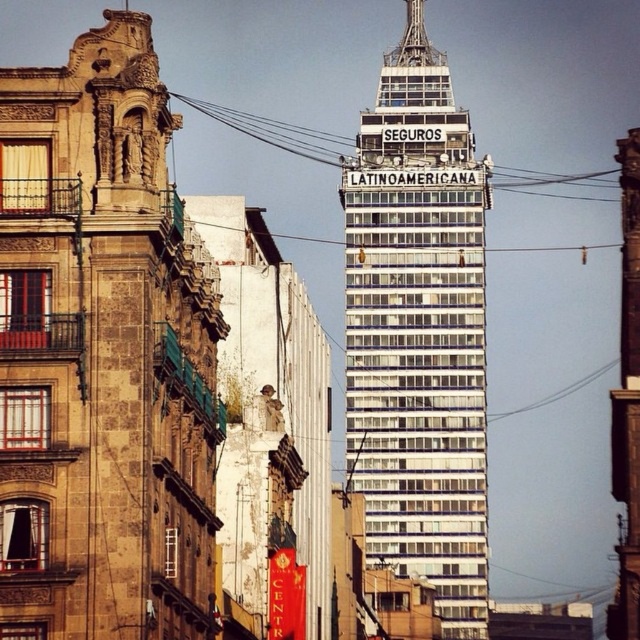
Question: Is brown stone building at left above white glass building at center?

Choices:
 (A) no
 (B) yes

Answer: (A)

Question: Does brown stone building at left have a lesser width compared to white glass building at center?

Choices:
 (A) yes
 (B) no

Answer: (A)

Question: Does brown stone building at left come in front of white glass building at center?

Choices:
 (A) no
 (B) yes

Answer: (B)

Question: Which of the following is the farthest from the observer?

Choices:
 (A) brown stone building at left
 (B) white glass building at center

Answer: (B)